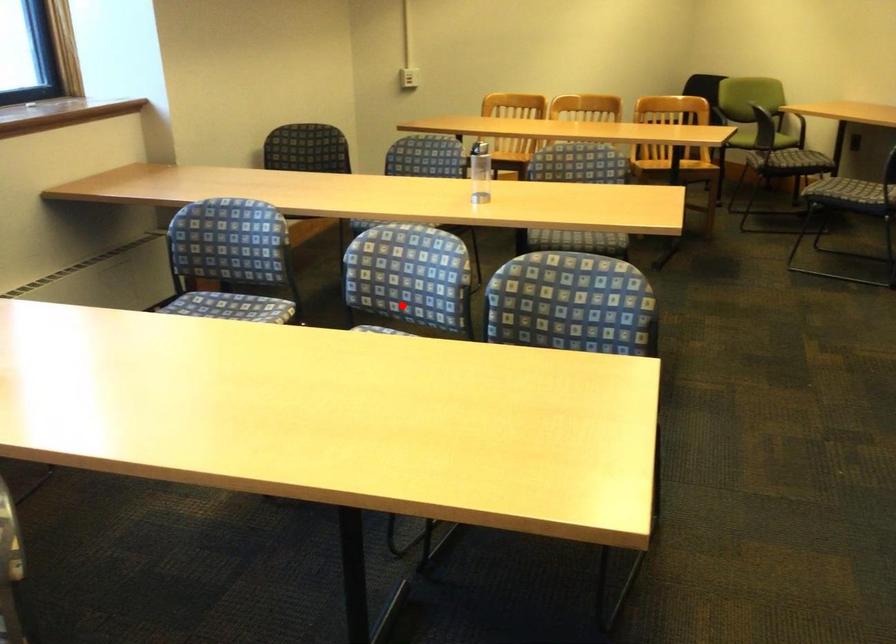
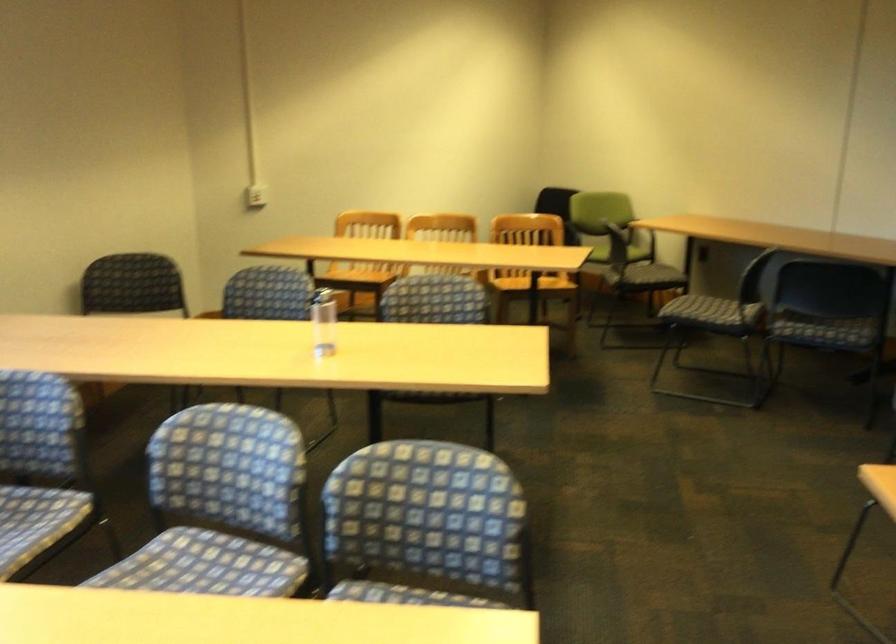
Question: I am providing you with two images of the same scene from different viewpoints. In image1, a red point is highlighted. Considering the same 3D point in image2, which of the following is correct?

Choices:
 (A) It is closer
 (B) It is farther

Answer: (A)